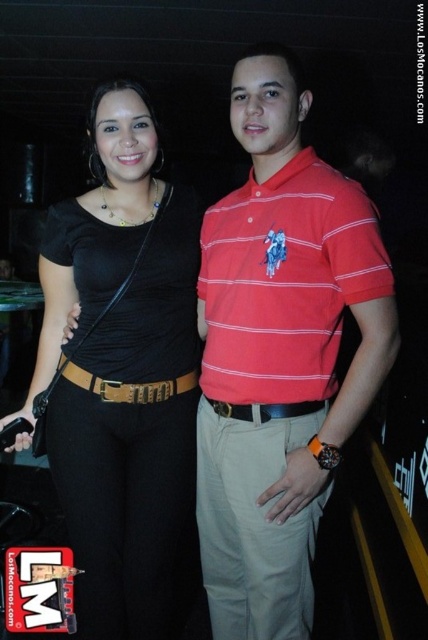
Question: Does matte red polo shirt at center appear on the right side of black matte shirt at center?

Choices:
 (A) no
 (B) yes

Answer: (B)

Question: Does matte red polo shirt at center appear on the left side of red striped polo shirt at center?

Choices:
 (A) no
 (B) yes

Answer: (B)

Question: Which point is closer to the camera?

Choices:
 (A) (348, 189)
 (B) (169, 452)
 (C) (332, 204)

Answer: (C)

Question: Among these objects, which one is farthest from the camera?

Choices:
 (A) black matte shirt at center
 (B) matte red polo shirt at center
 (C) black leather belt at center
 (D) red striped polo shirt at center

Answer: (A)

Question: Which point appears farthest from the camera in this image?

Choices:
 (A) (249, 336)
 (B) (261, 406)

Answer: (A)

Question: Can you confirm if black matte shirt at center is thinner than red striped polo shirt at center?

Choices:
 (A) no
 (B) yes

Answer: (A)